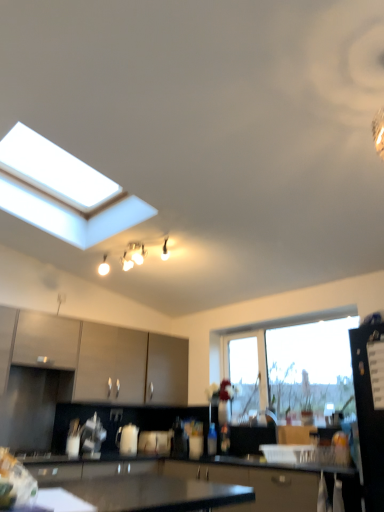
Question: Can you confirm if transparent glass window at center is shorter than black glossy refrigerator at right, the 1th appliance when ordered from right to left?

Choices:
 (A) no
 (B) yes

Answer: (B)

Question: Is transparent glass window at center in front of black glossy refrigerator at right, the first appliance in the top-to-bottom sequence?

Choices:
 (A) no
 (B) yes

Answer: (A)

Question: Does transparent glass window at center have a greater width compared to black glossy refrigerator at right, the first appliance in the top-to-bottom sequence?

Choices:
 (A) yes
 (B) no

Answer: (B)

Question: From a real-world perspective, is transparent glass window at center physically above black glossy refrigerator at right, placed as the 2th appliance when sorted from back to front?

Choices:
 (A) no
 (B) yes

Answer: (B)

Question: Can you confirm if transparent glass window at center is bigger than black glossy refrigerator at right, the first appliance in the top-to-bottom sequence?

Choices:
 (A) yes
 (B) no

Answer: (B)

Question: Is the depth of transparent glass window at center greater than that of black glossy refrigerator at right, placed as the 2th appliance when sorted from back to front?

Choices:
 (A) no
 (B) yes

Answer: (B)

Question: Is matte brown cabinet at left, acting as the first cabinetry starting from the left, inside transparent glass window at center?

Choices:
 (A) no
 (B) yes

Answer: (A)

Question: Considering the relative sizes of transparent glass window at center and matte brown cabinet at left, arranged as the 2th cabinetry when viewed from the right, in the image provided, is transparent glass window at center shorter than matte brown cabinet at left, arranged as the 2th cabinetry when viewed from the right,?

Choices:
 (A) yes
 (B) no

Answer: (B)

Question: Can you confirm if transparent glass window at center is wider than matte brown cabinet at left, arranged as the 2th cabinetry when viewed from the right?

Choices:
 (A) yes
 (B) no

Answer: (B)

Question: Does transparent glass window at center lie behind matte brown cabinet at left, acting as the first cabinetry starting from the left?

Choices:
 (A) yes
 (B) no

Answer: (B)

Question: Considering the relative sizes of transparent glass window at center and matte brown cabinet at left, acting as the first cabinetry starting from the left, in the image provided, is transparent glass window at center smaller than matte brown cabinet at left, acting as the first cabinetry starting from the left,?

Choices:
 (A) no
 (B) yes

Answer: (B)

Question: Is transparent glass window at center outside matte brown cabinet at left, arranged as the 2th cabinetry when viewed from the right?

Choices:
 (A) no
 (B) yes

Answer: (B)

Question: Is matte white light fixture at upper center completely or partially inside black glossy refrigerator at right, the first appliance in the top-to-bottom sequence?

Choices:
 (A) no
 (B) yes

Answer: (A)